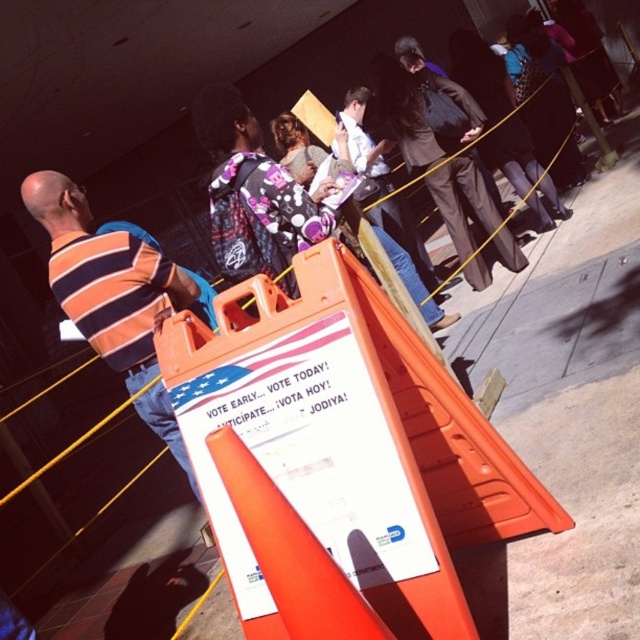
You are a photographer trying to capture a photo of the orange plastic traffic cone at center without including the orange striped shirt at left in the frame. Is it possible to do so based on their positions?

The orange striped shirt at left might be wider than orange plastic traffic cone at center, so there is a possibility that the shirt could block the cone depending on their exact positions. To ensure the cone is visible, adjust the camera angle to avoid the shirt.

You are standing at the voting queue and want to reach the sign to read it better. The queue is marked by a yellow rope barrier. There are two points along the rope barrier labeled as point (138, 280) and point (387, 636). Which point is closer to you so you can move towards it to get a better view of the sign?

Point (138, 280) is closer to you because it is further to the camera than point (387, 636), meaning it is physically nearer in the queue line.

You are a photographer trying to capture a candid shot of the orange striped shirt at left and the orange plastic traffic cone at center without moving the subjects. Based on their positions, which object is higher up in the frame?

The orange striped shirt at left is located above the orange plastic traffic cone at center, so it will appear higher up in the frame.